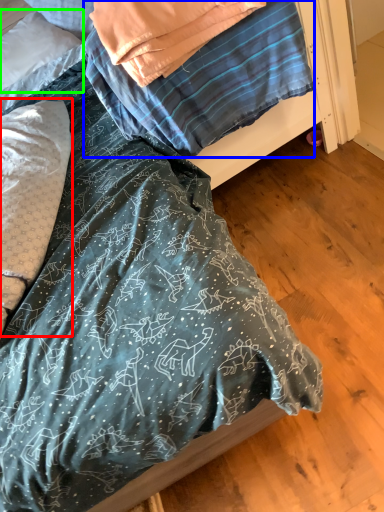
Question: Estimate the real-world distances between objects in this image. Which object is farther from pillow (highlighted by a red box), blanket (highlighted by a blue box) or pillow (highlighted by a green box)?

Choices:
 (A) blanket
 (B) pillow

Answer: (B)